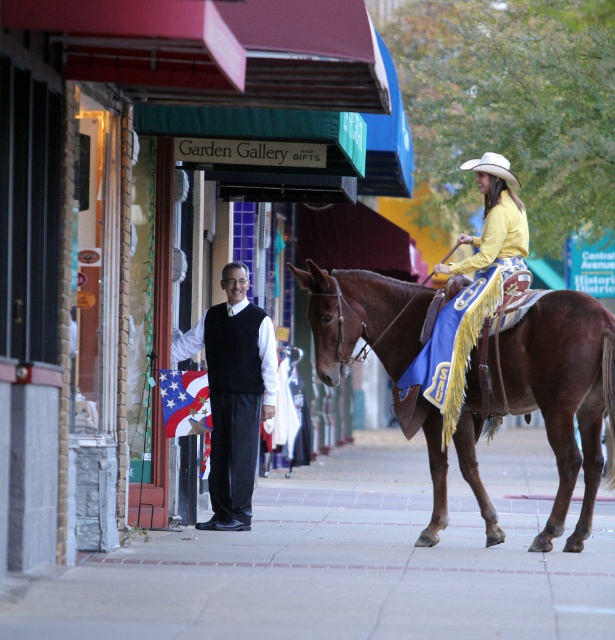
Question: Which point is closer to the camera?

Choices:
 (A) (244, 307)
 (B) (498, 163)
 (C) (197, 589)
 (D) (352, 285)

Answer: (C)

Question: Among these objects, which one is nearest to the camera?

Choices:
 (A) white felt cowboy hat at upper center
 (B) american flag fabric at center
 (C) smooth concrete pavement at center
 (D) brown leather horse at center

Answer: (C)

Question: Considering the relative positions of american flag fabric at center and white felt cowboy hat at upper center in the image provided, where is american flag fabric at center located with respect to white felt cowboy hat at upper center?

Choices:
 (A) left
 (B) right

Answer: (A)

Question: Where is smooth concrete pavement at center located in relation to brown leather horse at center in the image?

Choices:
 (A) above
 (B) below

Answer: (B)

Question: Can you confirm if smooth concrete pavement at center is positioned to the left of brown leather horse at center?

Choices:
 (A) no
 (B) yes

Answer: (B)

Question: Which of the following is the farthest from the observer?

Choices:
 (A) (496, 154)
 (B) (517, 225)
 (C) (347, 321)

Answer: (A)